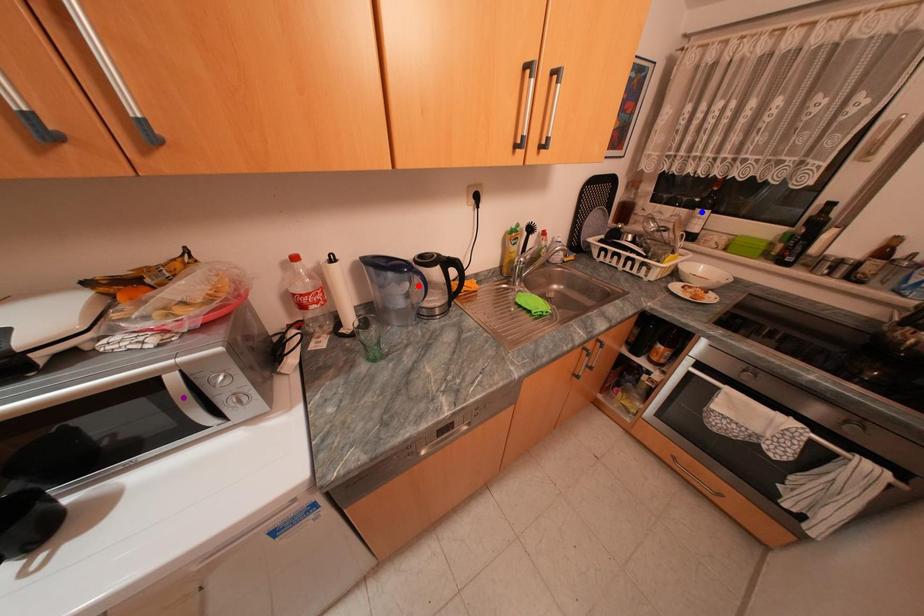
In the scene shown: Order these from nearest to farthest:
1. purple point
2. blue point
3. red point

purple point → red point → blue point